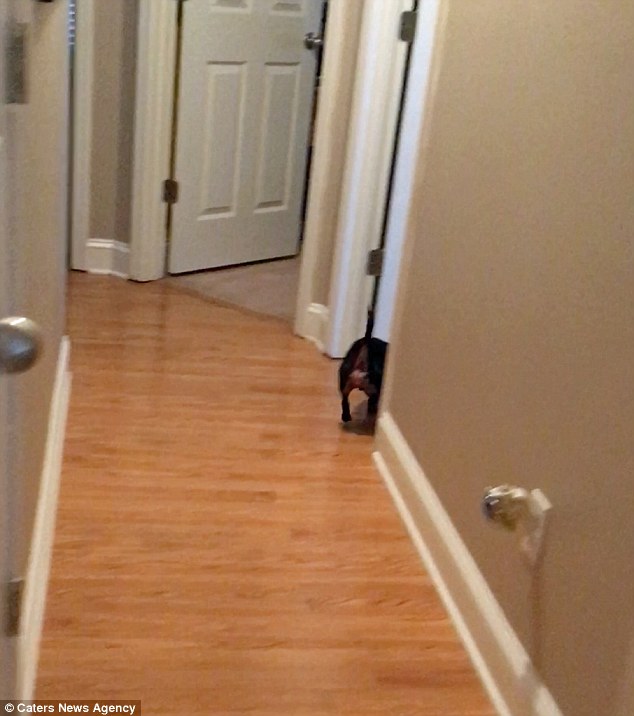
Where is `the back wall`? This screenshot has width=634, height=716. the back wall is located at coordinates (113, 82).